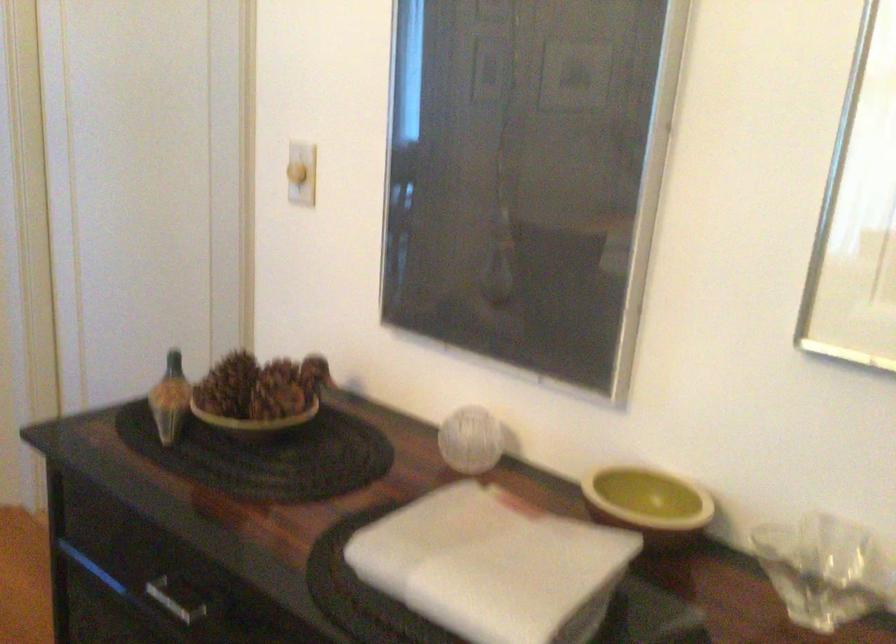
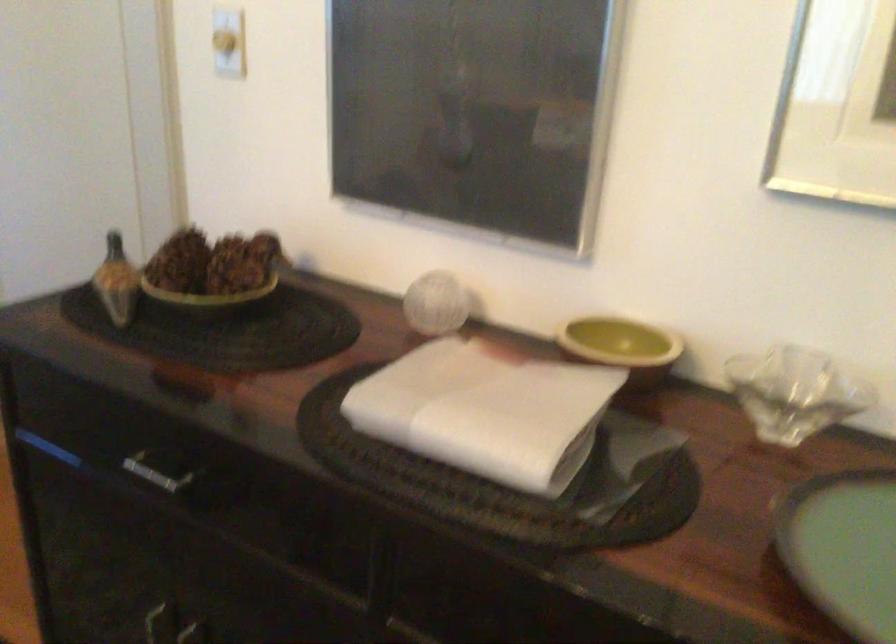
Question: The images are taken continuously from a first-person perspective. In which direction is your viewpoint rotating?

Choices:
 (A) Left
 (B) Right
 (C) Up
 (D) Down

Answer: (D)